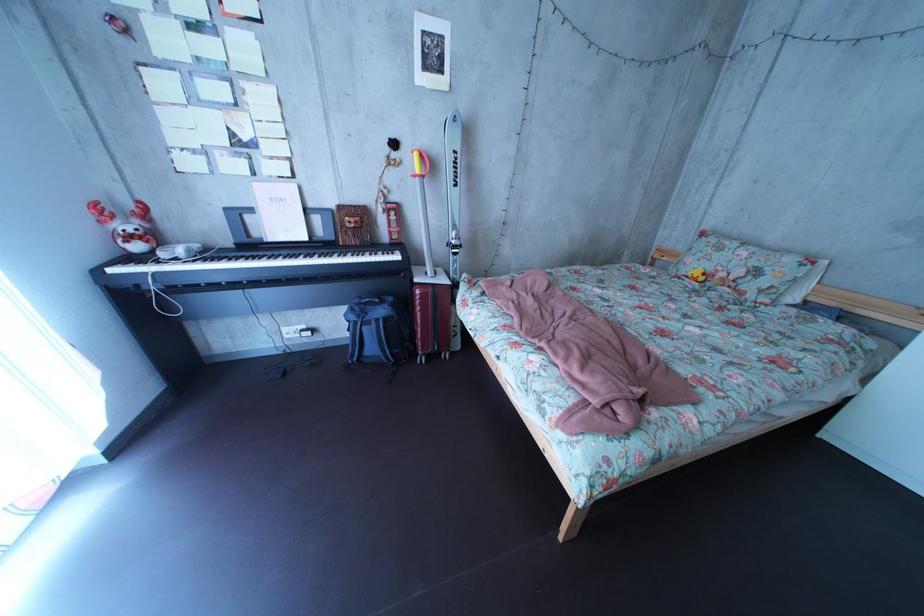
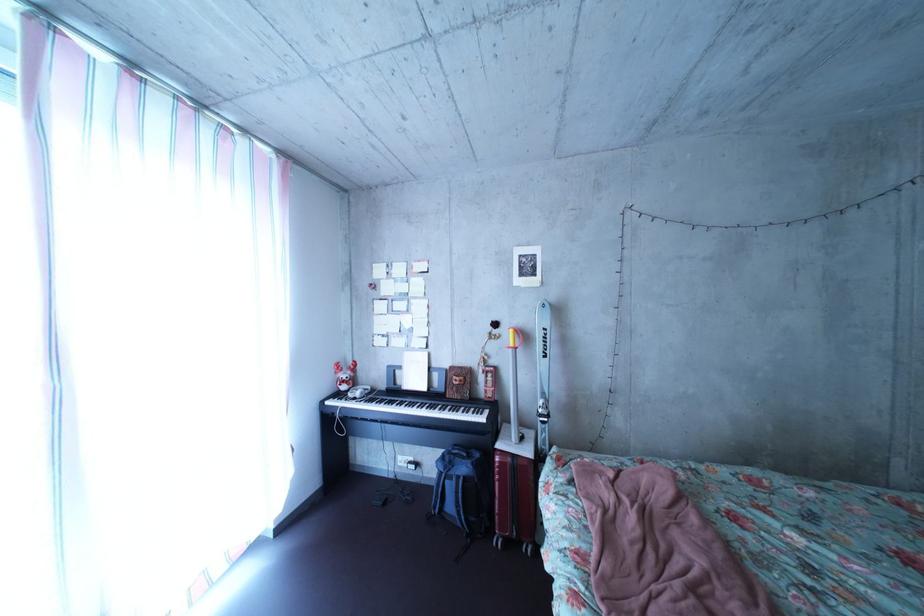
The point at [395,320] is marked in the first image. Where is the corresponding point in the second image?

(479, 477)